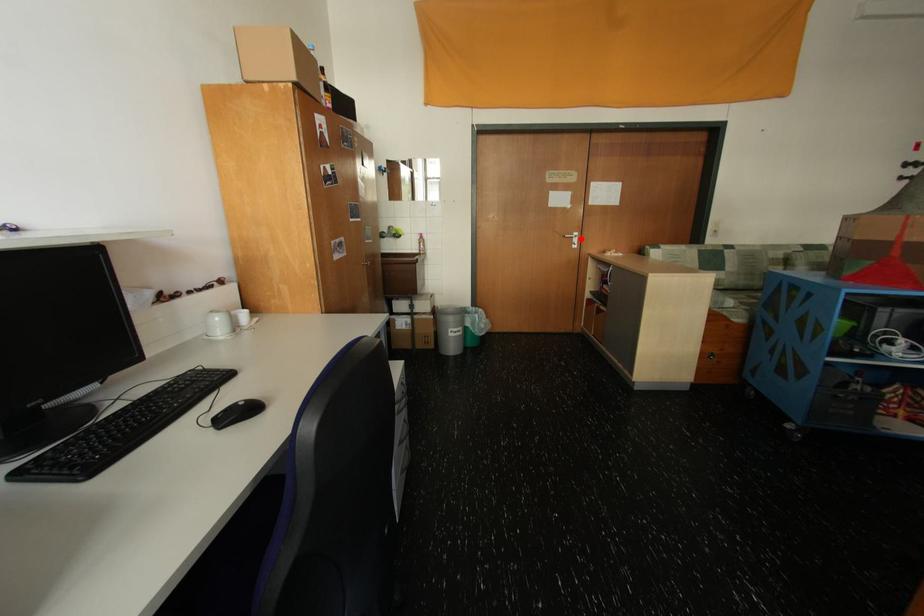
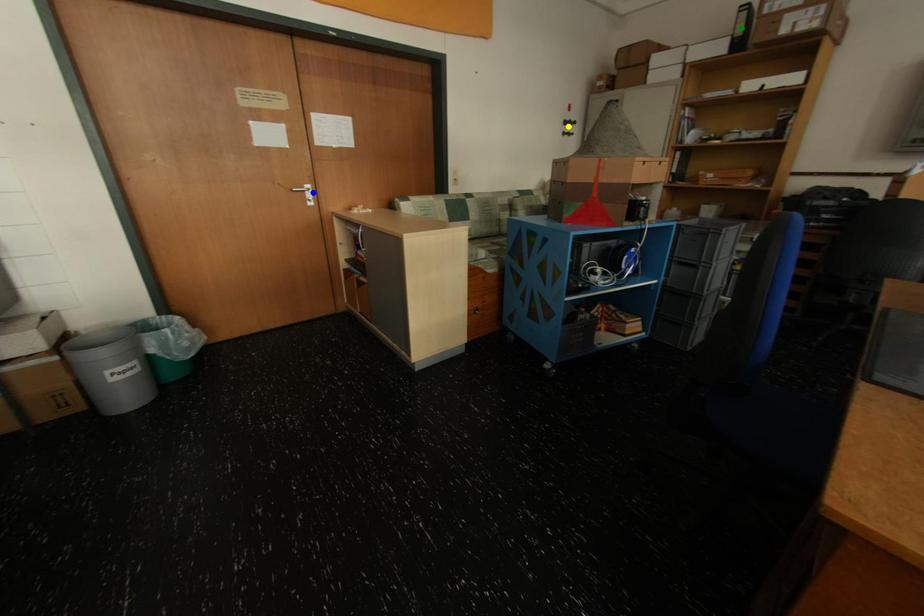
Question: I am providing you with two images of the same scene from different viewpoints. A red point is marked on the first image. You are given multiple points on the second image. Which point in image 2 represents the same 3d spot as the red point in image 1?

Choices:
 (A) yellow point
 (B) blue point
 (C) green point

Answer: (B)